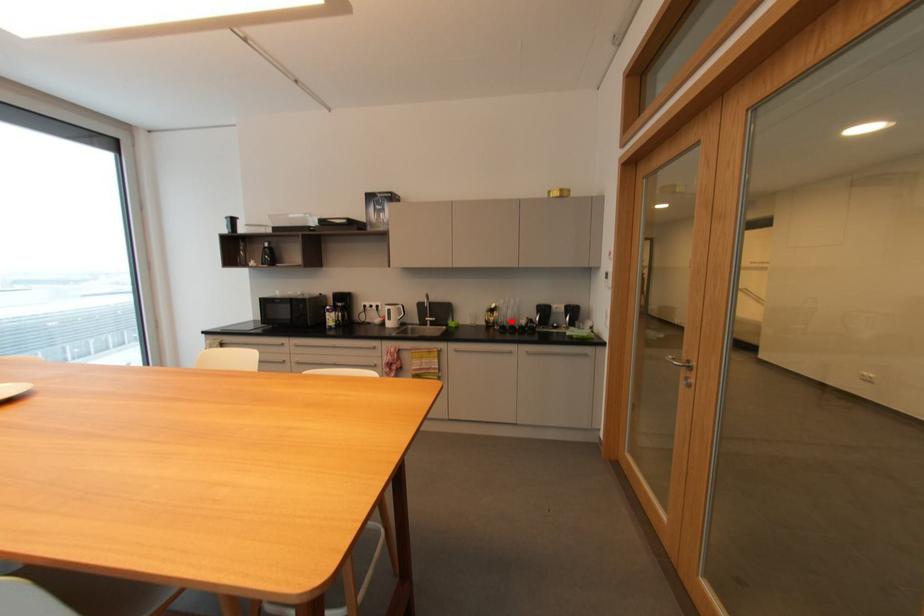
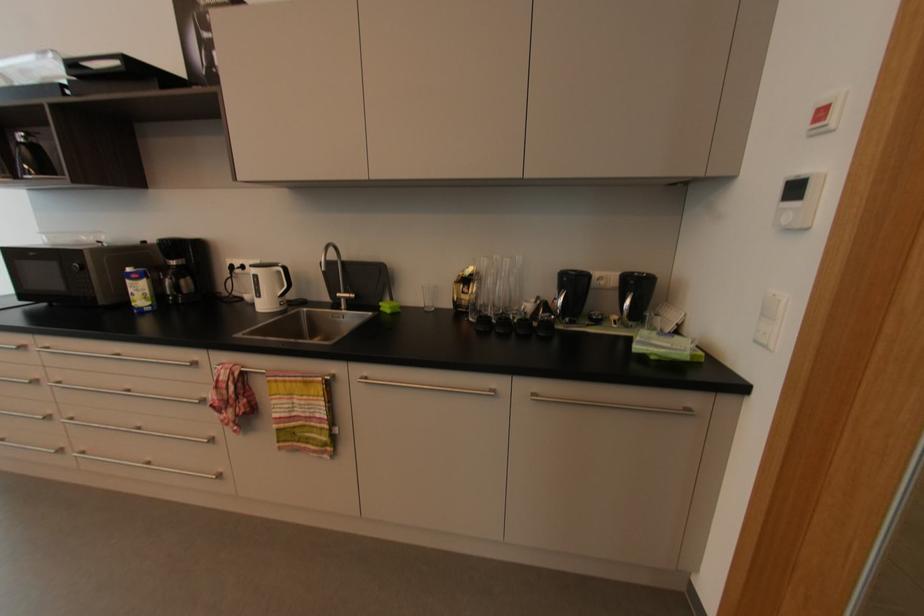
Question: I am providing you with two images of the same scene from different viewpoints. A red point is marked on the first image. Can you still see the location of the red point in image 2?

Choices:
 (A) Yes
 (B) No

Answer: (A)